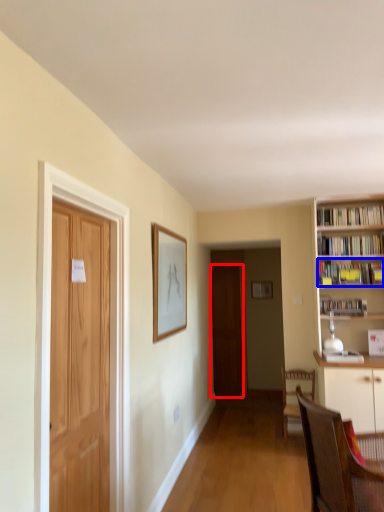
Question: Which object appears closest to the camera in this image, door (highlighted by a red box) or book (highlighted by a blue box)?

Choices:
 (A) door
 (B) book

Answer: (B)